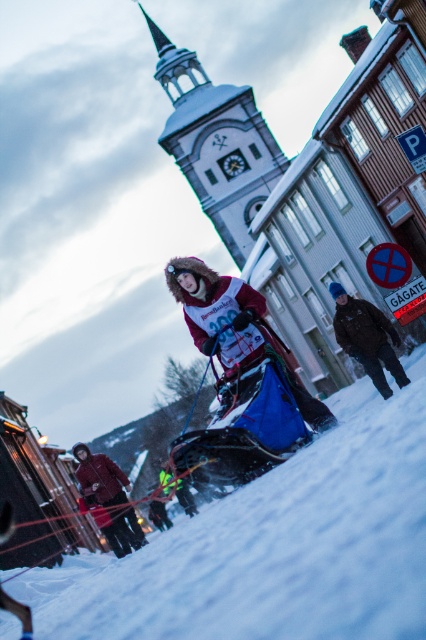
Question: Which point is farther to the camera?

Choices:
 (A) dark brown leather jacket at center
 (B) matte red ski suit at center
 (C) white powdery snow at center

Answer: (A)

Question: Which point appears closest to the camera in this image?

Choices:
 (A) (92, 472)
 (B) (388, 426)
 (C) (207, 332)

Answer: (B)

Question: Is white powdery snow at center above matte red ski suit at center?

Choices:
 (A) yes
 (B) no

Answer: (B)

Question: Can you confirm if white powdery snow at center is bigger than matte red jacket at lower left?

Choices:
 (A) no
 (B) yes

Answer: (B)

Question: Among these objects, which one is nearest to the camera?

Choices:
 (A) dark brown leather jacket at center
 (B) matte red ski suit at center
 (C) white powdery snow at center

Answer: (C)

Question: Where is white powdery snow at center located in relation to dark brown leather jacket at center in the image?

Choices:
 (A) left
 (B) right

Answer: (A)